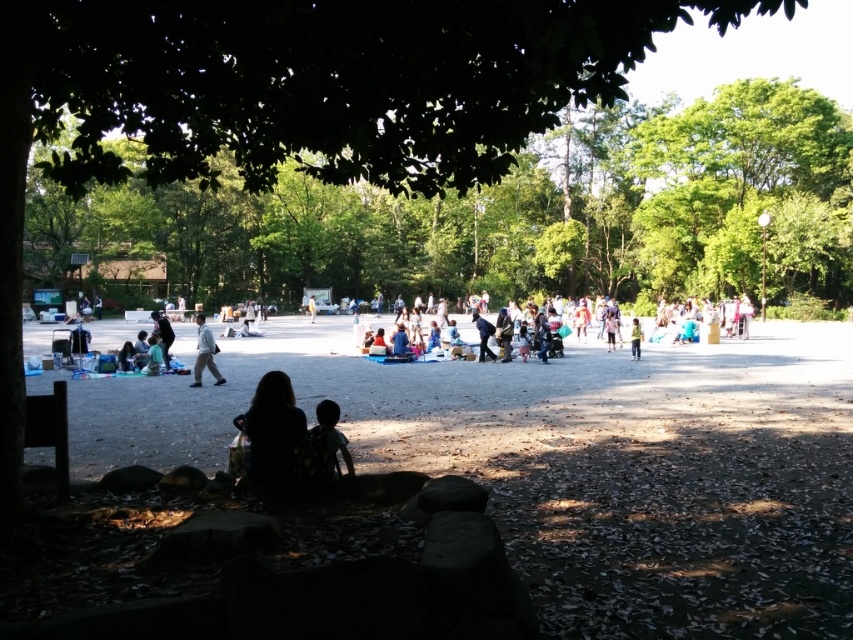
Question: Can you confirm if silhouette fabric at lower center is positioned to the right of yellow fabric at center?

Choices:
 (A) yes
 (B) no

Answer: (A)

Question: Is the position of silhouette fabric at lower center less distant than that of dark hair at center?

Choices:
 (A) yes
 (B) no

Answer: (B)

Question: Estimate the real-world distances between objects in this image. Which object is farther from the dark blue fabric at center?

Choices:
 (A) light blue fabric at center
 (B) dark hair at center
 (C) light brown fabric jacket at center

Answer: (B)

Question: Which is nearer to the dark hair at center?

Choices:
 (A) white cotton shirt at center
 (B) green leafy tree at center
 (C) silhouette fabric at lower center
 (D) dark blue fabric at center

Answer: (C)

Question: Which of the following is the closest to the observer?

Choices:
 (A) (328, 420)
 (B) (157, 340)
 (C) (346, 211)
 (D) (309, 305)

Answer: (A)

Question: Is silhouette fabric at lower center to the left of white cotton shirt at center from the viewer's perspective?

Choices:
 (A) yes
 (B) no

Answer: (B)